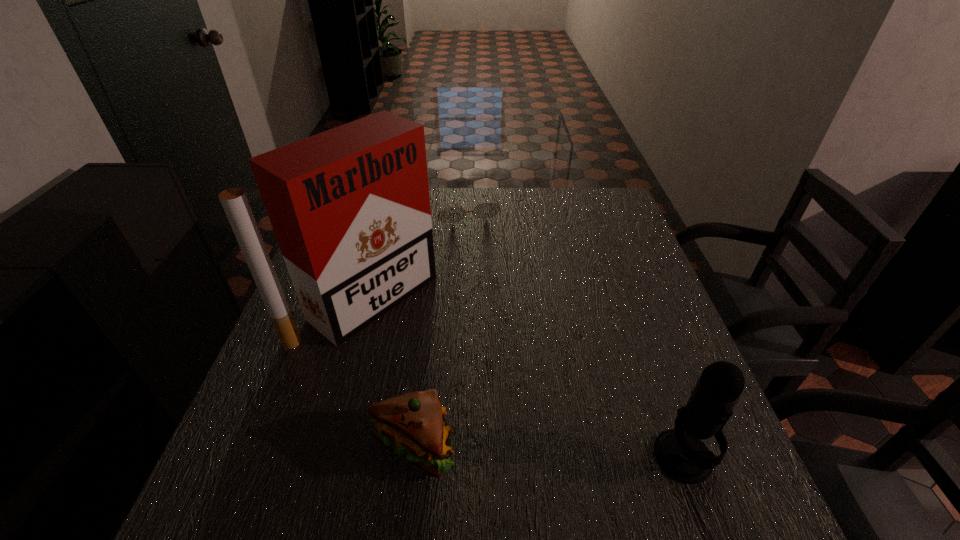
Find the location of `vacant position located on the front-facing side of the tallest object`. vacant position located on the front-facing side of the tallest object is located at coordinates (454, 360).

You are a GUI agent. You are given a task and a screenshot of the screen. Output one action in this format:
    pyautogui.click(x=<x>, y=<y>)
    Task: Click on the blank area located 0.130m on the front-facing side of the tallest object
    Image resolution: width=960 pixels, height=540 pixels.
    Given the screenshot: What is the action you would take?
    pyautogui.click(x=454, y=360)

The image size is (960, 540). What are the coordinates of `vacant space situated on the face of the sunglasses` in the screenshot? It's located at (479, 239).

The height and width of the screenshot is (540, 960). I want to click on vacant space located on the face of the sunglasses, so click(x=484, y=252).

At what (x,y) coordinates should I click in order to perform the action: click on vacant space situated on the face of the sunglasses. Please return your answer as a coordinate pair (x, y). Looking at the image, I should click on (508, 308).

Where is `object present at the far edge`? object present at the far edge is located at coordinates (485, 210).

This screenshot has width=960, height=540. What are the coordinates of `sandwich at the near edge` in the screenshot? It's located at (412, 424).

Locate an element on the screen. The width and height of the screenshot is (960, 540). microphone located at the near edge is located at coordinates (680, 453).

Identify the location of object situated at the left edge. The image size is (960, 540). (350, 208).

Locate an element on the screen. object present at the right edge is located at coordinates (680, 453).